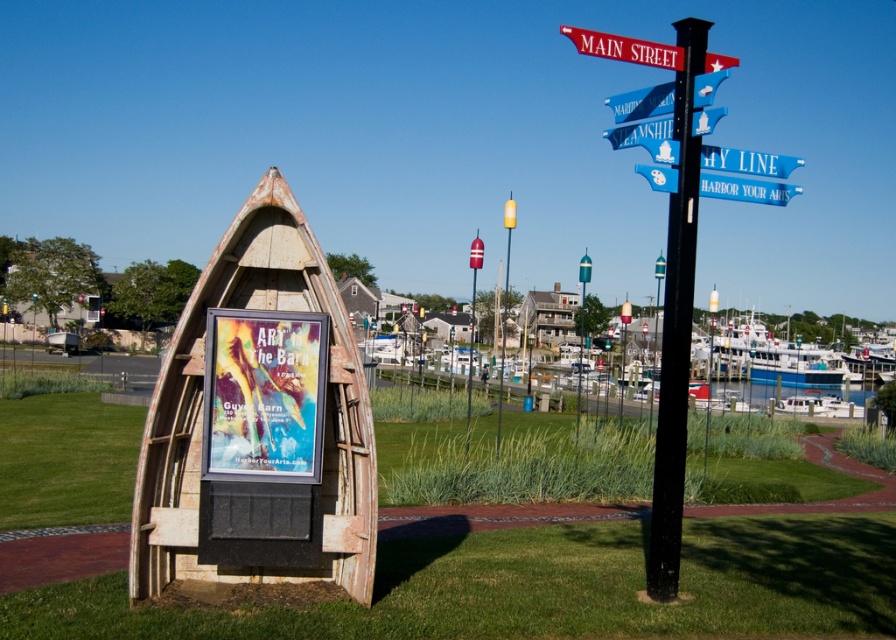
Based on the photo, can you confirm if rusty wood canoe at center is shorter than green grass at lower center?

No, rusty wood canoe at center is not shorter than green grass at lower center.

The width and height of the screenshot is (896, 640). What do you see at coordinates (257, 420) in the screenshot?
I see `rusty wood canoe at center` at bounding box center [257, 420].

In order to click on rusty wood canoe at center in this screenshot , I will do tap(257, 420).

Can you confirm if blue painted wood sign at upper center is positioned above rustic wood boat at center?

Indeed, blue painted wood sign at upper center is positioned over rustic wood boat at center.

Between point (648, 166) and point (539, 346), which one is positioned behind?

Positioned behind is point (539, 346).

Does point (767, 188) lie behind point (518, 310)?

No, (767, 188) is closer to viewer.

Locate an element on the screen. blue painted wood sign at upper center is located at coordinates [x=745, y=189].

Is red painted metal signpost at upper center positioned at the back of blue painted wood sign at upper center?

No, it is not.

Who is higher up, red painted metal signpost at upper center or blue painted wood sign at upper center?

red painted metal signpost at upper center is higher up.

Identify the location of red painted metal signpost at upper center. click(x=625, y=48).